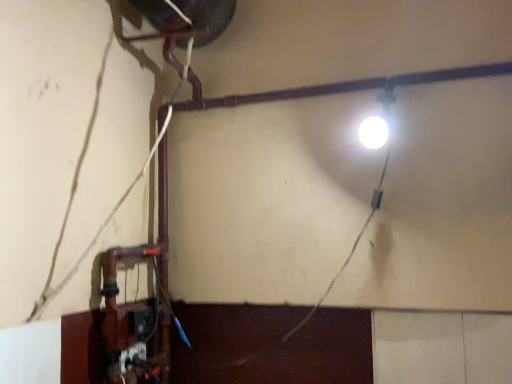
Describe the element at coordinates (132, 324) in the screenshot. I see `rusty metal water pipe at lower left` at that location.

The width and height of the screenshot is (512, 384). Find the location of `rusty metal water pipe at lower left`. rusty metal water pipe at lower left is located at coordinates (132, 324).

In the scene shown: Measure the distance between rusty metal water pipe at lower left and camera.

rusty metal water pipe at lower left and camera are 1.22 meters apart from each other.

The height and width of the screenshot is (384, 512). What are the coordinates of `rusty metal water pipe at lower left` in the screenshot? It's located at (132, 324).